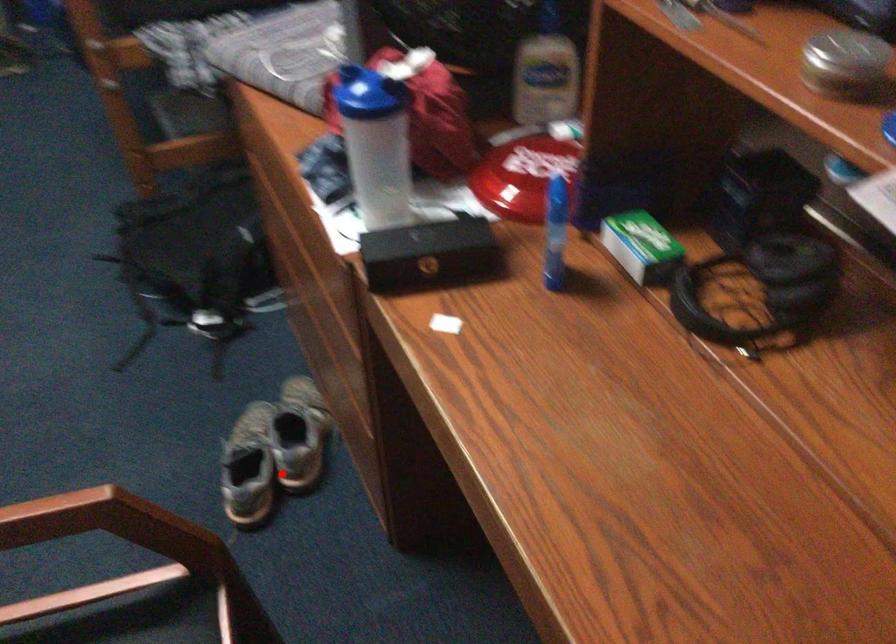
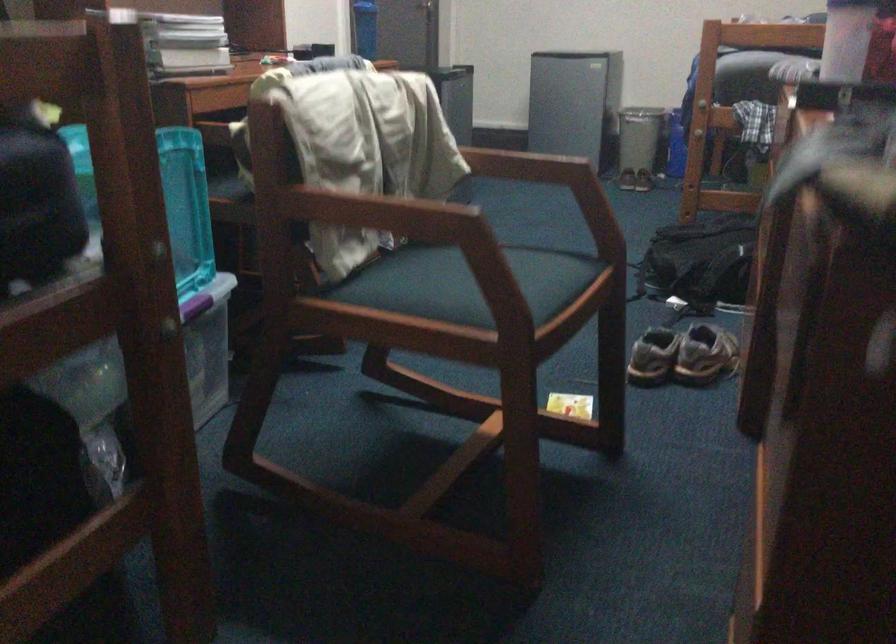
Question: I am providing you with two images of the same scene from different viewpoints. A red point is shown in image1. For the corresponding object point in image2, is it positioned nearer or farther from the camera?

Choices:
 (A) Nearer
 (B) Farther

Answer: (B)